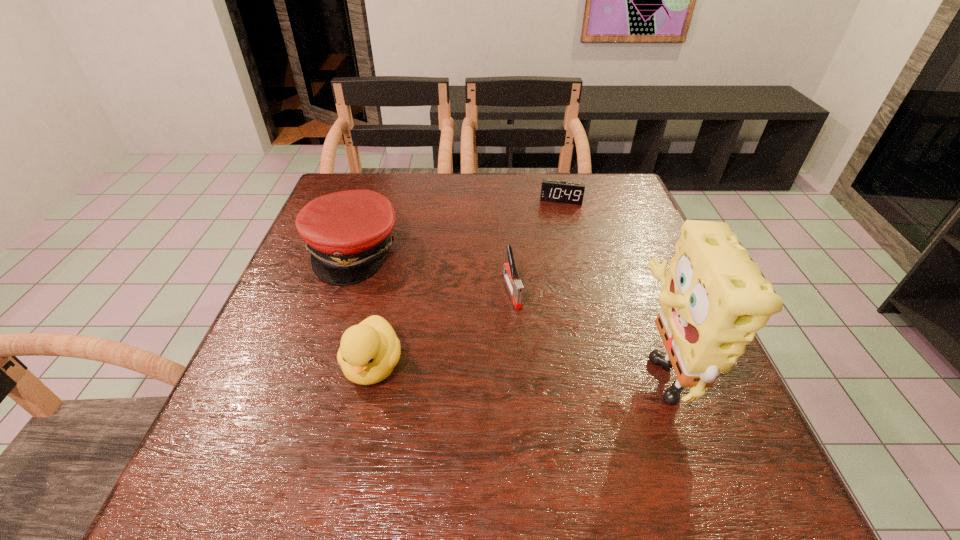
Locate an element on the screen. The width and height of the screenshot is (960, 540). vacant area that lies between the duck and the stapler is located at coordinates (443, 328).

The image size is (960, 540). What are the coordinates of `free point between the cap and the sponge` in the screenshot? It's located at (504, 310).

Identify the location of unoccupied position between the cap and the alarm clock. 457,226.

Find the location of a particular element. The height and width of the screenshot is (540, 960). free space between the tallest object and the stapler is located at coordinates (584, 329).

Identify which object is located as the nearest to the farthest object. Please provide its 2D coordinates. Your answer should be formatted as a tuple, i.e. [(x, y)], where the tuple contains the x and y coordinates of a point satisfying the conditions above.

[(515, 286)]

This screenshot has height=540, width=960. What are the coordinates of `the fourth closest object to the third object from left to right` in the screenshot? It's located at (557, 191).

Identify the location of vacant region that satisfies the following two spatial constraints: 1. on the front side of the shortest object; 2. on the face of the sponge. This screenshot has height=540, width=960. (604, 368).

Image resolution: width=960 pixels, height=540 pixels. What are the coordinates of `vacant space that satisfies the following two spatial constraints: 1. on the front-facing side of the sponge; 2. on the face of the duck` in the screenshot? It's located at (372, 368).